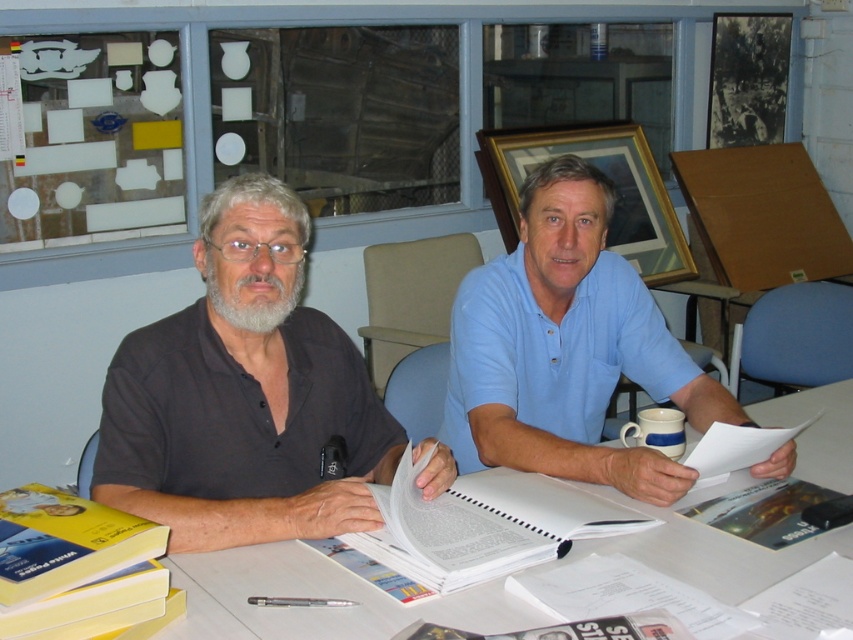
You are standing 3 feet away from the table in the office scene. There is a point at coordinates point (714, 568) on the table. If you want to reach that point, will you be able to do so without moving closer to the table?

The distance of point (714, 568) from viewer is 4.27 feet. Since you are already 3 feet away from the table, the point is 1.27 feet further away from you, so you would need to move closer to reach it.